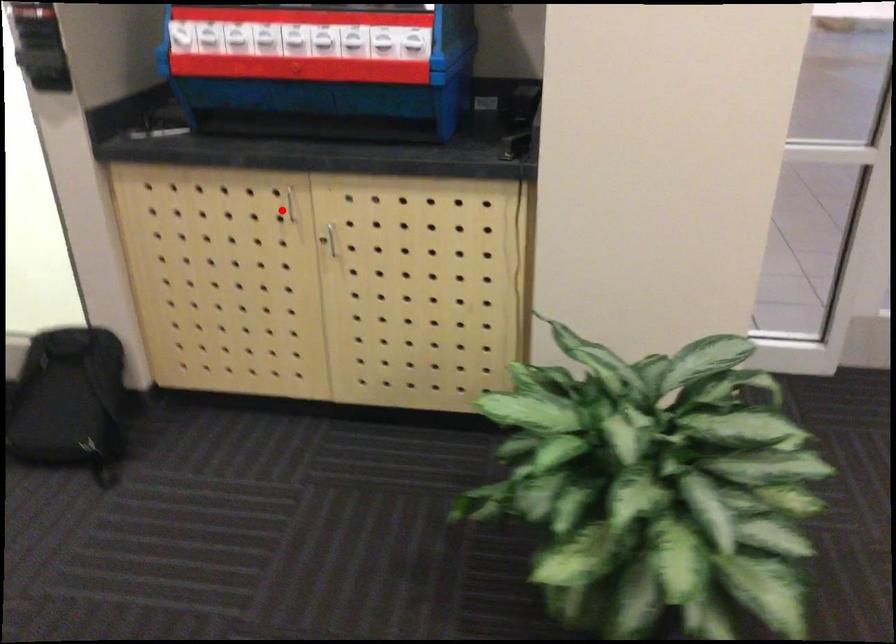
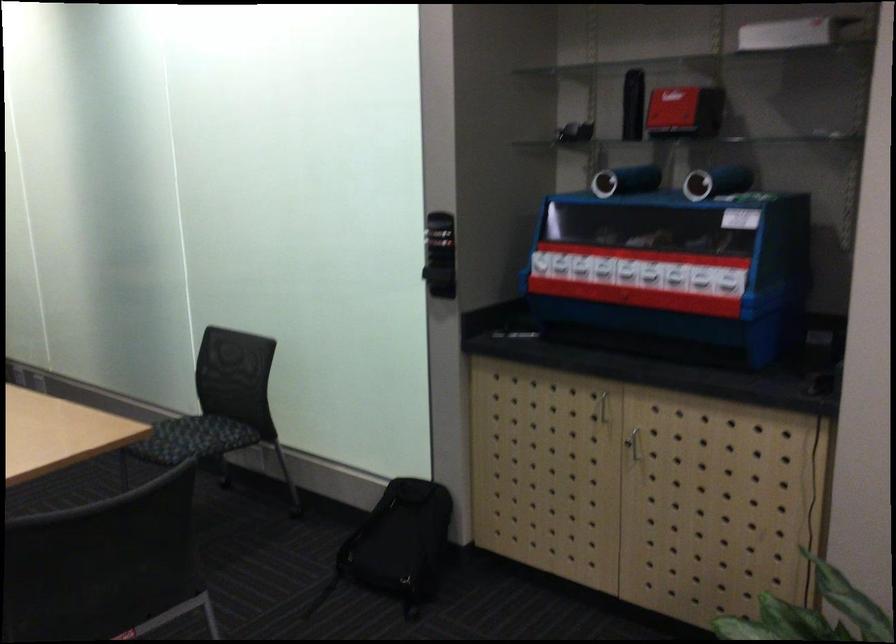
Where in the second image is the point corresponding to the highlighted location from the first image?

(601, 406)